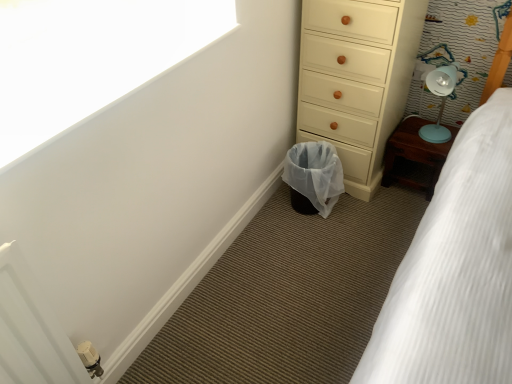
Question: Is wooden bedside table at right bigger than white textured bed at lower right?

Choices:
 (A) yes
 (B) no

Answer: (B)

Question: Is wooden bedside table at right oriented away from white textured bed at lower right?

Choices:
 (A) yes
 (B) no

Answer: (B)

Question: Can you confirm if wooden bedside table at right is positioned to the right of white textured bed at lower right?

Choices:
 (A) yes
 (B) no

Answer: (A)

Question: From a real-world perspective, is wooden bedside table at right located beneath white textured bed at lower right?

Choices:
 (A) yes
 (B) no

Answer: (A)

Question: Is wooden bedside table at right oriented towards white textured bed at lower right?

Choices:
 (A) yes
 (B) no

Answer: (A)

Question: Is white matte window screen at upper left in front of or behind white textured bed at lower right in the image?

Choices:
 (A) front
 (B) behind

Answer: (B)

Question: Do you think white matte window screen at upper left is within white textured bed at lower right, or outside of it?

Choices:
 (A) inside
 (B) outside

Answer: (B)

Question: Considering the positions of white matte window screen at upper left and white textured bed at lower right in the image, is white matte window screen at upper left bigger or smaller than white textured bed at lower right?

Choices:
 (A) small
 (B) big

Answer: (A)

Question: From a real-world perspective, is white matte window screen at upper left physically located above or below white textured bed at lower right?

Choices:
 (A) below
 (B) above

Answer: (B)

Question: From the image's perspective, is wooden bedside table at right positioned above or below white textured bed at lower right?

Choices:
 (A) above
 (B) below

Answer: (A)

Question: Considering the positions of wooden bedside table at right and white textured bed at lower right in the image, is wooden bedside table at right wider or thinner than white textured bed at lower right?

Choices:
 (A) wide
 (B) thin

Answer: (B)

Question: From their relative heights in the image, would you say wooden bedside table at right is taller or shorter than white textured bed at lower right?

Choices:
 (A) short
 (B) tall

Answer: (A)

Question: Based on their sizes in the image, would you say wooden bedside table at right is bigger or smaller than white textured bed at lower right?

Choices:
 (A) big
 (B) small

Answer: (B)

Question: Is translucent plastic laundry basket at lower center wider or thinner than matte cream chest of drawers at lower right?

Choices:
 (A) wide
 (B) thin

Answer: (B)

Question: Is translucent plastic laundry basket at lower center taller or shorter than matte cream chest of drawers at lower right?

Choices:
 (A) short
 (B) tall

Answer: (A)